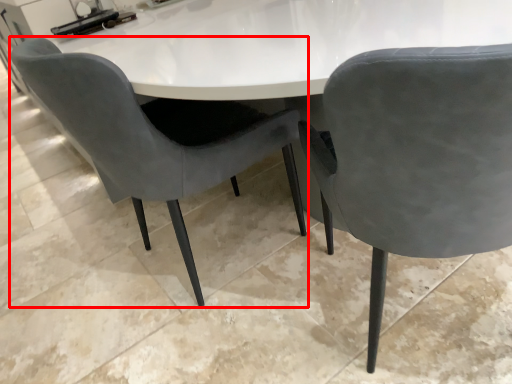
Question: From the image's perspective, considering the relative positions of chair (annotated by the red box) and chair in the image provided, where is chair (annotated by the red box) located with respect to the staircase?

Choices:
 (A) above
 (B) below

Answer: (A)